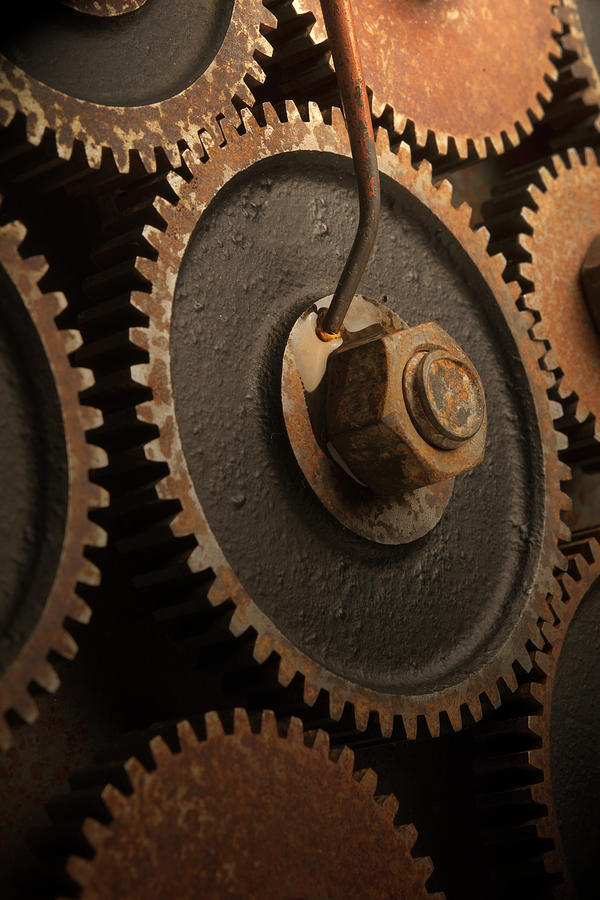
You are a GUI agent. You are given a task and a screenshot of the screen. Output one action in this format:
    pyautogui.click(x=<x>, y=<y>)
    Task: Click on the washer
    Image resolution: width=600 pixels, height=900 pixels.
    Given the screenshot: What is the action you would take?
    pyautogui.click(x=347, y=505)